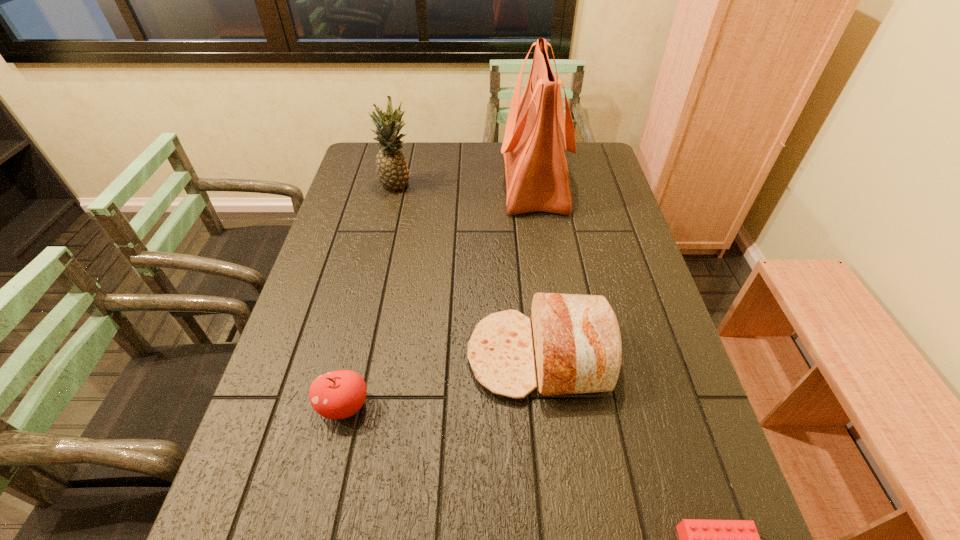
At what (x,y) coordinates should I click in order to perform the action: click on vacant area that lies between the fourth tallest object and the bread. Please return your answer as a coordinate pair (x, y). This screenshot has height=540, width=960. Looking at the image, I should click on (442, 381).

Choose which object is the nearest neighbor to the bread. Please provide its 2D coordinates. Your answer should be formatted as a tuple, i.e. [(x, y)], where the tuple contains the x and y coordinates of a point satisfying the conditions above.

[(340, 394)]

Point out which object is positioned as the nearest to the nearest object. Please provide its 2D coordinates. Your answer should be formatted as a tuple, i.e. [(x, y)], where the tuple contains the x and y coordinates of a point satisfying the conditions above.

[(577, 343)]

Where is `free space in the image that satisfies the following two spatial constraints: 1. on the front pocket of the tallest object; 2. on the front side of the pineapple`? free space in the image that satisfies the following two spatial constraints: 1. on the front pocket of the tallest object; 2. on the front side of the pineapple is located at coordinates (535, 187).